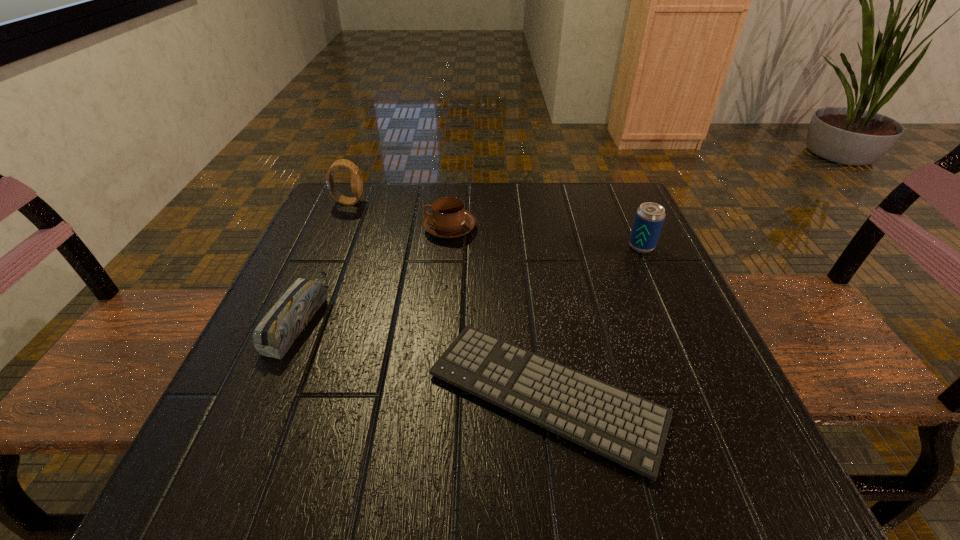
Identify the location of vacant space located on the back of the pencil box. This screenshot has height=540, width=960. (348, 200).

Where is `vacant space located 0.050m on the right of the computer keyboard`? This screenshot has width=960, height=540. vacant space located 0.050m on the right of the computer keyboard is located at coordinates (698, 394).

At what (x,y) coordinates should I click in order to perform the action: click on watch at the far edge. Please return your answer as a coordinate pair (x, y). Image resolution: width=960 pixels, height=540 pixels. Looking at the image, I should click on (356, 181).

Image resolution: width=960 pixels, height=540 pixels. Find the location of `cappuccino that is at the far edge`. cappuccino that is at the far edge is located at coordinates (448, 219).

Locate an element on the screen. This screenshot has height=540, width=960. object that is at the near edge is located at coordinates (623, 427).

At what (x,y) coordinates should I click in order to perform the action: click on watch present at the left edge. Please return your answer as a coordinate pair (x, y). This screenshot has height=540, width=960. Looking at the image, I should click on pyautogui.click(x=356, y=181).

Locate an element on the screen. pencil box positioned at the left edge is located at coordinates (274, 335).

Find the location of `beer can situated at the right edge`. beer can situated at the right edge is located at coordinates (649, 218).

At what (x,y) coordinates should I click in order to perform the action: click on computer keyboard located in the right edge section of the desktop. Please return your answer as a coordinate pair (x, y). Looking at the image, I should click on (623, 427).

At what (x,y) coordinates should I click in order to perform the action: click on object that is positioned at the far left corner. Please return your answer as a coordinate pair (x, y). The width and height of the screenshot is (960, 540). Looking at the image, I should click on [356, 181].